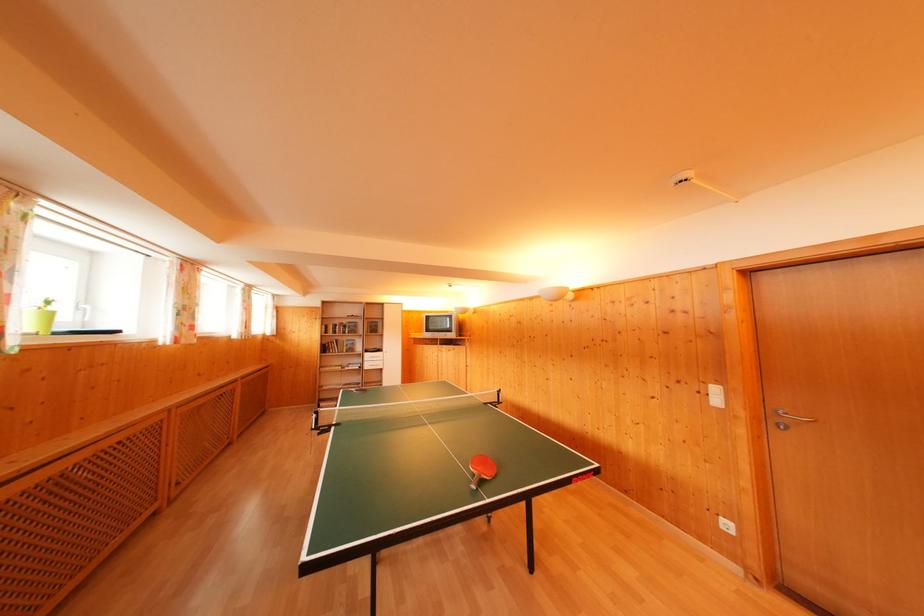
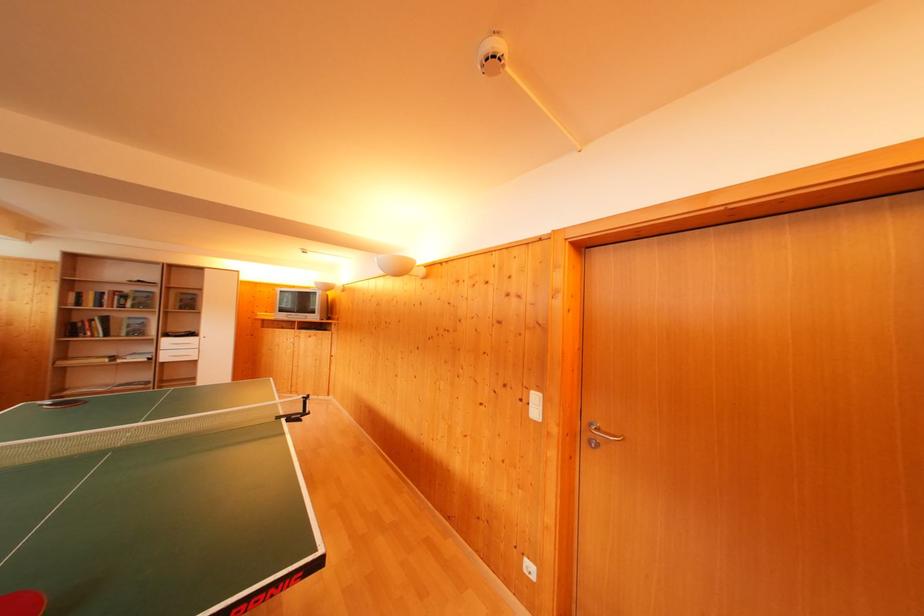
Locate, in the second image, the point that corresponds to [722,407] in the first image.

(541, 418)